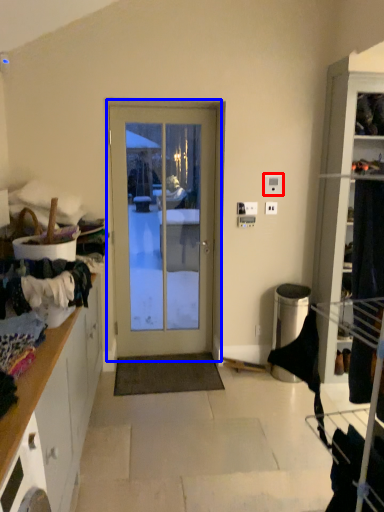
Question: Which object is closer to the camera taking this photo, light switch (highlighted by a red box) or door (highlighted by a blue box)?

Choices:
 (A) light switch
 (B) door

Answer: (B)